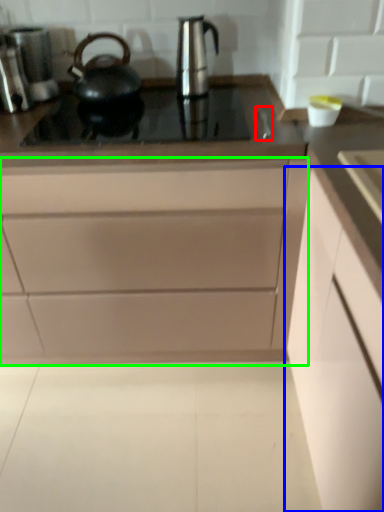
Question: Considering the real-world distances, which object is closest to faucet (highlighted by a red box)? cabinetry (highlighted by a blue box) or cabinetry (highlighted by a green box).

Choices:
 (A) cabinetry
 (B) cabinetry

Answer: (A)